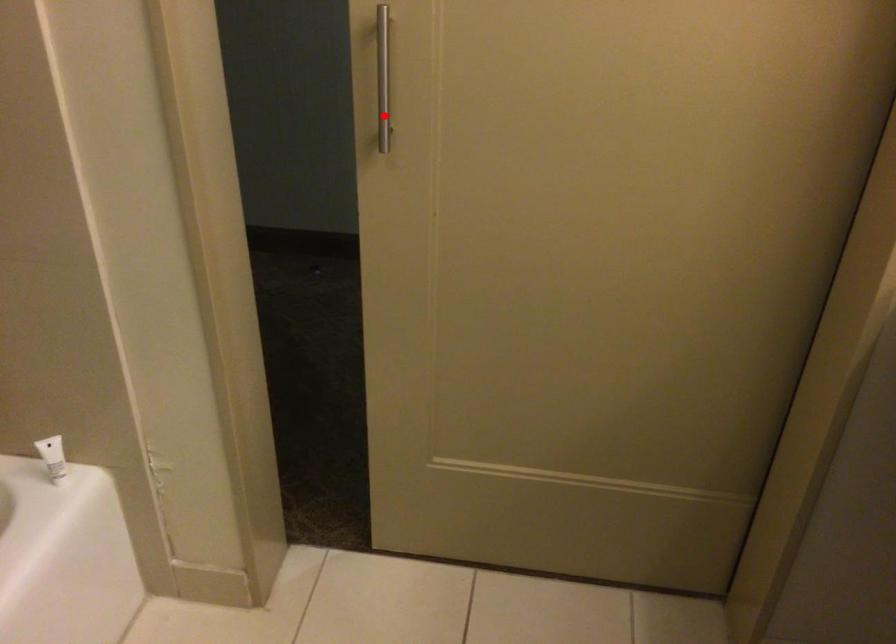
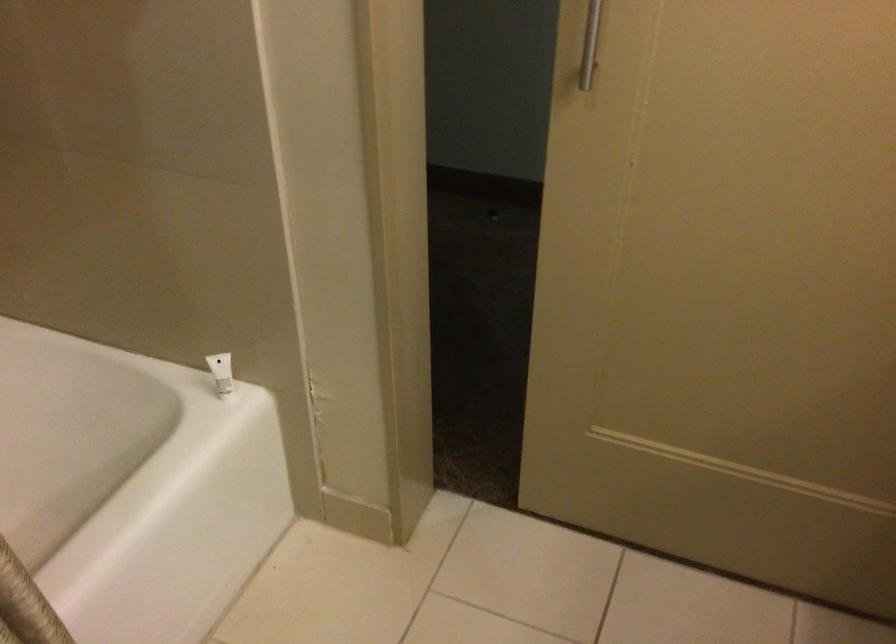
Question: I am providing you with two images of the same scene from different viewpoints. Image1 has a red point marked. In image2, the corresponding 3D location appears at what relative position? Reply with the corresponding letter.

Choices:
 (A) Closer
 (B) Farther

Answer: (A)